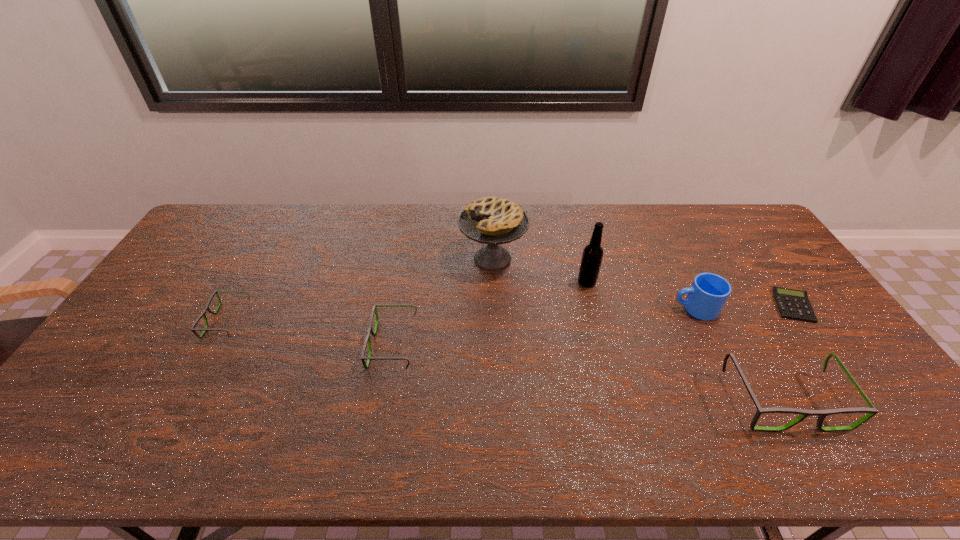
Find the location of a particular element. The width and height of the screenshot is (960, 540). unoccupied area between the fourth object from left to right and the mug is located at coordinates (641, 295).

Select which object is the third closest to the beer bottle. Please provide its 2D coordinates. Your answer should be formatted as a tuple, i.e. [(x, y)], where the tuple contains the x and y coordinates of a point satisfying the conditions above.

[(871, 411)]

Locate an element on the screen. the fourth closest object to the fourth object from left to right is located at coordinates (367, 340).

Image resolution: width=960 pixels, height=540 pixels. What are the coordinates of `spectacles that is the closest to the second object from left to right` in the screenshot? It's located at (193, 330).

Select which spectacles is the second closest to the tallest spectacles. Please provide its 2D coordinates. Your answer should be formatted as a tuple, i.e. [(x, y)], where the tuple contains the x and y coordinates of a point satisfying the conditions above.

[(193, 330)]

Locate an element on the screen. blank space that satisfies the following two spatial constraints: 1. on the front side of the calculator; 2. on the right side of the beer bottle is located at coordinates (593, 306).

You are a GUI agent. You are given a task and a screenshot of the screen. Output one action in this format:
    pyautogui.click(x=<x>, y=<y>)
    Task: Click on the free space that satisfies the following two spatial constraints: 1. on the cut side of the pie; 2. on the left side of the rightmost object
    This screenshot has width=960, height=540.
    Given the screenshot: What is the action you would take?
    pyautogui.click(x=494, y=306)